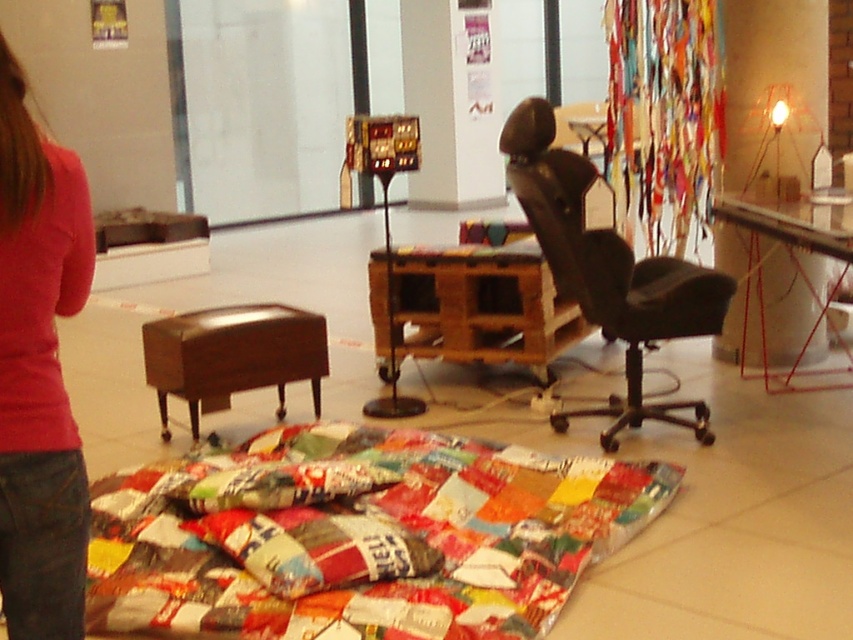
You are organizing a small event in this space and need to place a large rectangular table between the pink fabric at lower left and the black leather swivel chair at center right. Given their sizes, will the table fit comfortably between them without overlapping either object?

The pink fabric at lower left is smaller than the black leather swivel chair at center right. Since the table is large and rectangular, it might not fit comfortably between them as the space between the two objects may be constrained by their size difference. However, without specific measurements of the table and the distance between the objects, it is difficult to determine with certainty.

You are a person who is 1.8 meters tall and wants to sit comfortably in either the black leather swivel chair at center right or the brown leather stool at lower left. Based on their heights, which one would be more suitable for you?

The black leather swivel chair at center right is much taller than the brown leather stool at lower left, so it would be more suitable for someone who is 1.8 meters tall as it provides a better height match for comfortable sitting.